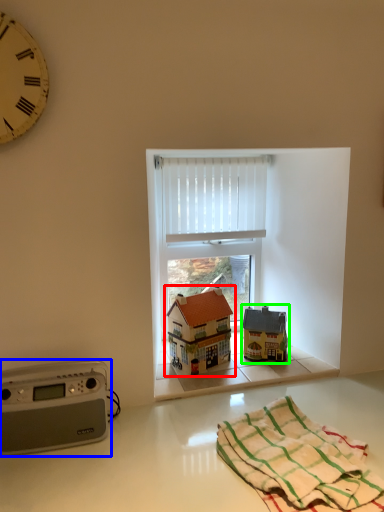
Question: Which is farther away from toy (highlighted by a red box)? stereo (highlighted by a blue box) or toy (highlighted by a green box)?

Choices:
 (A) stereo
 (B) toy

Answer: (A)